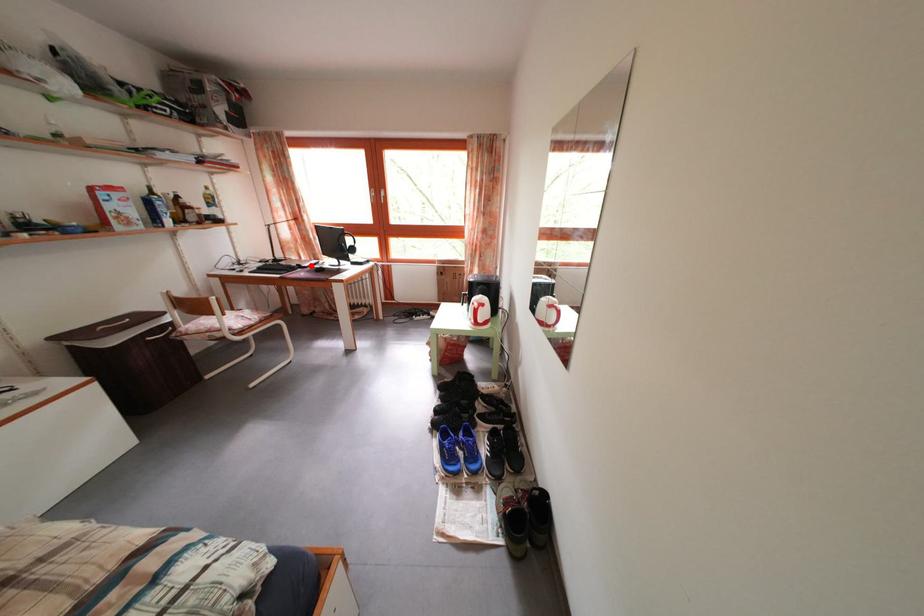
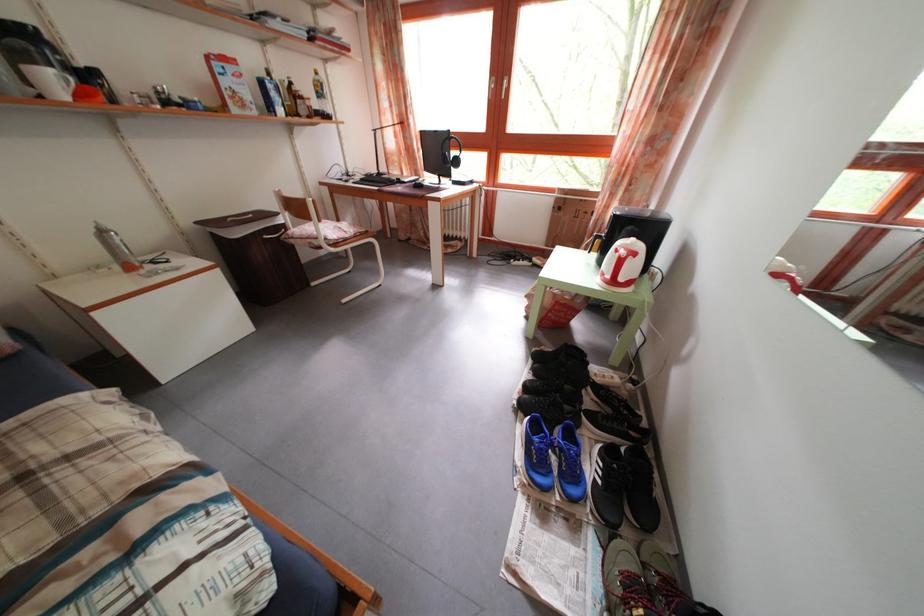
Where in the second image is the point corresponding to the highlighted location from the first image?

(412, 182)